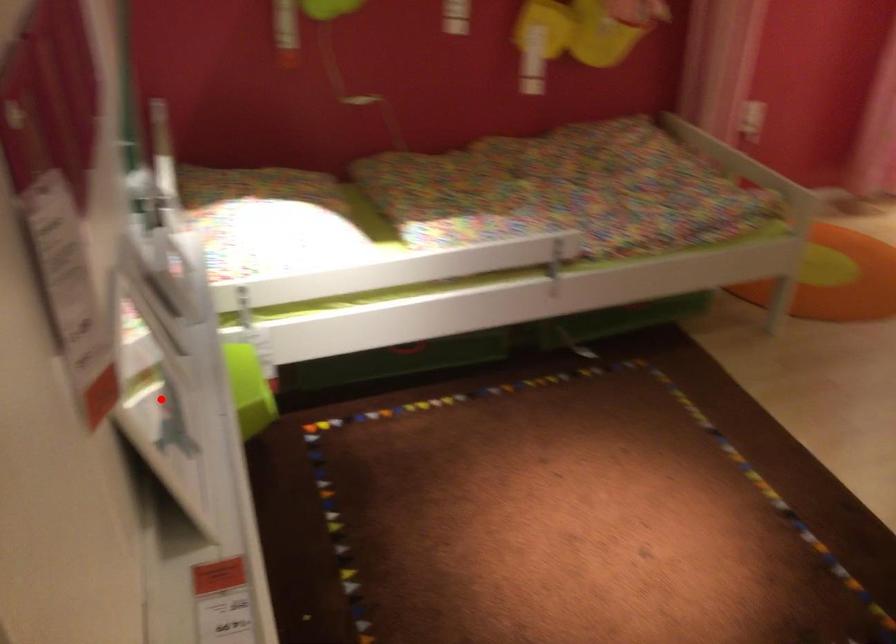
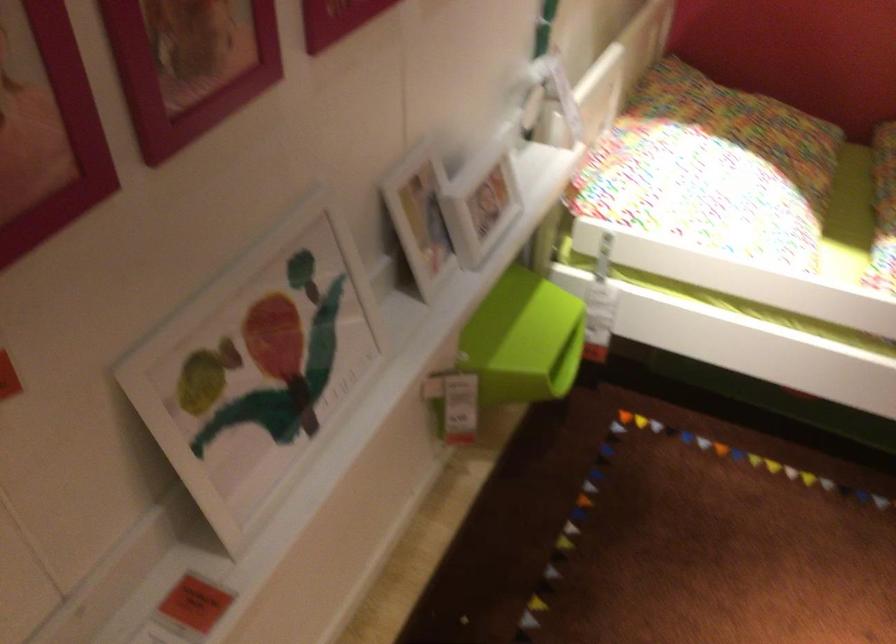
Question: I am providing you with two images of the same scene from different viewpoints. Image1 has a red point marked. In image2, the corresponding 3D location appears at what relative position? Reply with the corresponding letter.

Choices:
 (A) Closer
 (B) Farther

Answer: (A)